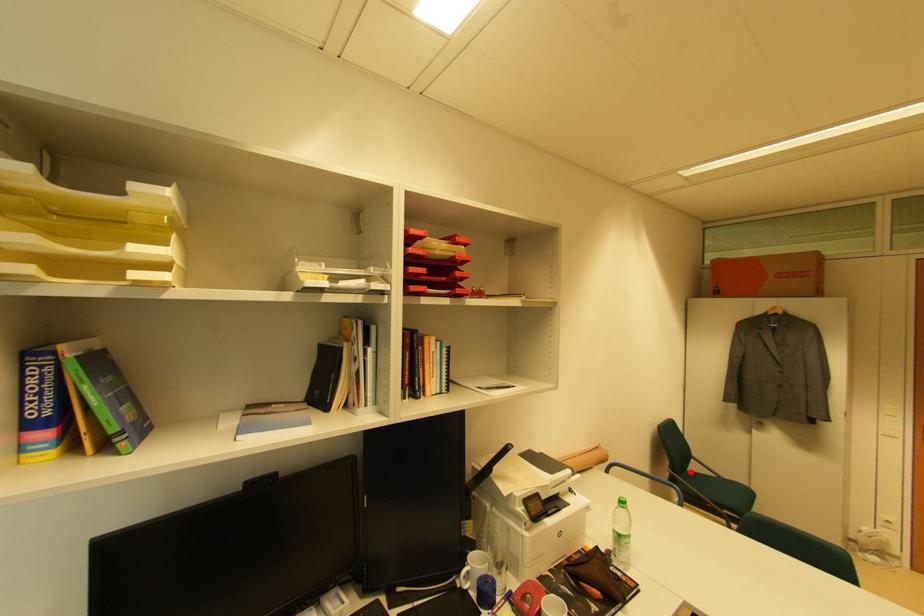
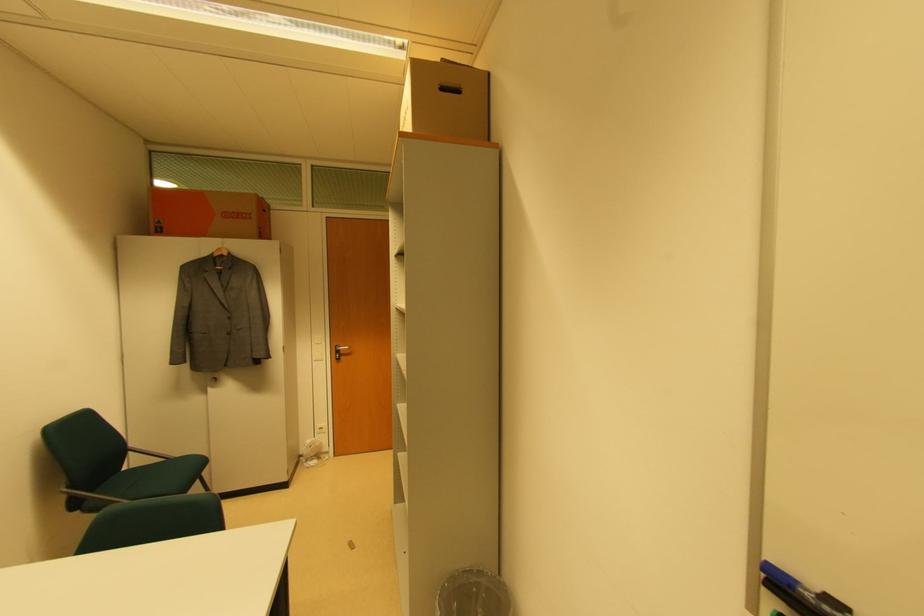
Question: I am providing you with two images of the same scene from different viewpoints. Given a red point in image1, look at the same physical point in image2. Is it:

Choices:
 (A) Closer to the viewpoint
 (B) Farther from the viewpoint

Answer: (B)